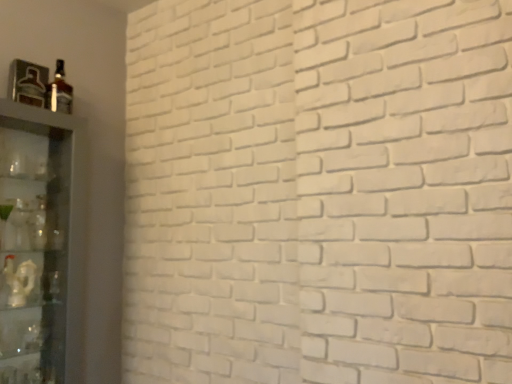
Describe the element at coordinates (59, 91) in the screenshot. This screenshot has width=512, height=384. I see `matte glass bottle at upper left, which is the first bottle from right to left` at that location.

Locate an element on the screen. clear glass shelf at left is located at coordinates (40, 244).

Where is `metallic glass bottle at upper left, placed as the first bottle when sorted from left to right`? This screenshot has height=384, width=512. metallic glass bottle at upper left, placed as the first bottle when sorted from left to right is located at coordinates (29, 84).

Would you say clear glass shelf at left is to the left or to the right of metallic glass bottle at upper left, placed as the first bottle when sorted from left to right, in the picture?

clear glass shelf at left is to the right of metallic glass bottle at upper left, placed as the first bottle when sorted from left to right.

Can you confirm if clear glass shelf at left is taller than metallic glass bottle at upper left, which is counted as the 2th bottle, starting from the right?

Correct, clear glass shelf at left is much taller as metallic glass bottle at upper left, which is counted as the 2th bottle, starting from the right.

Is clear glass shelf at left aimed at metallic glass bottle at upper left, placed as the first bottle when sorted from left to right?

No, clear glass shelf at left is not aimed at metallic glass bottle at upper left, placed as the first bottle when sorted from left to right.

Which object is thinner, clear glass shelf at left or metallic glass bottle at upper left, placed as the first bottle when sorted from left to right?

metallic glass bottle at upper left, placed as the first bottle when sorted from left to right.

Does clear glass shelf at left have a lesser width compared to matte glass bottle at upper left, acting as the second bottle starting from the left?

In fact, clear glass shelf at left might be wider than matte glass bottle at upper left, acting as the second bottle starting from the left.

Is matte glass bottle at upper left, acting as the second bottle starting from the left, completely or partially inside clear glass shelf at left?

Definitely not — matte glass bottle at upper left, acting as the second bottle starting from the left, is not inside clear glass shelf at left.

Is clear glass shelf at left far away from matte glass bottle at upper left, which is the first bottle from right to left?

They are positioned close to each other.

Who is taller, matte glass bottle at upper left, acting as the second bottle starting from the left, or clear glass shelf at left?

clear glass shelf at left is taller.

Is matte glass bottle at upper left, acting as the second bottle starting from the left, inside or outside of clear glass shelf at left?

matte glass bottle at upper left, acting as the second bottle starting from the left, is not enclosed by clear glass shelf at left.

Considering the relative positions of matte glass bottle at upper left, acting as the second bottle starting from the left, and metallic glass bottle at upper left, placed as the first bottle when sorted from left to right, in the image provided, is matte glass bottle at upper left, acting as the second bottle starting from the left, to the left or to the right of metallic glass bottle at upper left, placed as the first bottle when sorted from left to right,?

From the image, it's evident that matte glass bottle at upper left, acting as the second bottle starting from the left, is to the right of metallic glass bottle at upper left, placed as the first bottle when sorted from left to right.

Is matte glass bottle at upper left, which is the first bottle from right to left, facing towards metallic glass bottle at upper left, placed as the first bottle when sorted from left to right?

No, matte glass bottle at upper left, which is the first bottle from right to left, is not turned towards metallic glass bottle at upper left, placed as the first bottle when sorted from left to right.

Measure the distance from matte glass bottle at upper left, which is the first bottle from right to left, to metallic glass bottle at upper left, which is counted as the 2th bottle, starting from the right.

matte glass bottle at upper left, which is the first bottle from right to left, and metallic glass bottle at upper left, which is counted as the 2th bottle, starting from the right, are 2.59 inches apart.

Would you say metallic glass bottle at upper left, which is counted as the 2th bottle, starting from the right, is part of matte glass bottle at upper left, which is the first bottle from right to left,'s contents?

No, metallic glass bottle at upper left, which is counted as the 2th bottle, starting from the right, is not a part of matte glass bottle at upper left, which is the first bottle from right to left.

Is the depth of metallic glass bottle at upper left, which is counted as the 2th bottle, starting from the right, greater than that of clear glass shelf at left?

Yes, the depth of metallic glass bottle at upper left, which is counted as the 2th bottle, starting from the right, is greater than that of clear glass shelf at left.

Which of these two, metallic glass bottle at upper left, placed as the first bottle when sorted from left to right, or clear glass shelf at left, stands taller?

clear glass shelf at left is taller.

Considering the relative positions of metallic glass bottle at upper left, which is counted as the 2th bottle, starting from the right, and clear glass shelf at left in the image provided, is metallic glass bottle at upper left, which is counted as the 2th bottle, starting from the right, to the left or to the right of clear glass shelf at left?

metallic glass bottle at upper left, which is counted as the 2th bottle, starting from the right, is to the left of clear glass shelf at left.

Looking at their sizes, would you say metallic glass bottle at upper left, placed as the first bottle when sorted from left to right, is wider or thinner than matte glass bottle at upper left, which is the first bottle from right to left?

Considering their sizes, metallic glass bottle at upper left, placed as the first bottle when sorted from left to right, looks broader than matte glass bottle at upper left, which is the first bottle from right to left.

Is metallic glass bottle at upper left, placed as the first bottle when sorted from left to right, positioned with its back to matte glass bottle at upper left, acting as the second bottle starting from the left?

No, matte glass bottle at upper left, acting as the second bottle starting from the left, is not at the back of metallic glass bottle at upper left, placed as the first bottle when sorted from left to right.

Between metallic glass bottle at upper left, which is counted as the 2th bottle, starting from the right, and matte glass bottle at upper left, which is the first bottle from right to left, which one has less height?

With less height is metallic glass bottle at upper left, which is counted as the 2th bottle, starting from the right.

In the image, is metallic glass bottle at upper left, placed as the first bottle when sorted from left to right, positioned in front of or behind matte glass bottle at upper left, acting as the second bottle starting from the left?

Visually, metallic glass bottle at upper left, placed as the first bottle when sorted from left to right, is located in front of matte glass bottle at upper left, acting as the second bottle starting from the left.

This screenshot has width=512, height=384. What are the coordinates of `shelf in front of the metallic glass bottle at upper left, which is counted as the 2th bottle, starting from the right` in the screenshot? It's located at (40, 244).

From the image's perspective, which bottle is the 2nd one above the clear glass shelf at left? Please provide its 2D coordinates.

[(59, 91)]

Considering their positions, is clear glass shelf at left positioned further to metallic glass bottle at upper left, which is counted as the 2th bottle, starting from the right, than matte glass bottle at upper left, which is the first bottle from right to left?

clear glass shelf at left.

From the image, which object appears to be nearer to metallic glass bottle at upper left, which is counted as the 2th bottle, starting from the right, matte glass bottle at upper left, acting as the second bottle starting from the left, or clear glass shelf at left?

The object closer to metallic glass bottle at upper left, which is counted as the 2th bottle, starting from the right, is matte glass bottle at upper left, acting as the second bottle starting from the left.

In the scene shown: Which object lies nearer to the anchor point matte glass bottle at upper left, which is the first bottle from right to left, clear glass shelf at left or metallic glass bottle at upper left, which is counted as the 2th bottle, starting from the right?

Based on the image, metallic glass bottle at upper left, which is counted as the 2th bottle, starting from the right, appears to be nearer to matte glass bottle at upper left, which is the first bottle from right to left.

Looking at the image, which one is located closer to clear glass shelf at left, matte glass bottle at upper left, which is the first bottle from right to left, or metallic glass bottle at upper left, placed as the first bottle when sorted from left to right?

metallic glass bottle at upper left, placed as the first bottle when sorted from left to right, is closer to clear glass shelf at left.

When comparing their distances from clear glass shelf at left, does metallic glass bottle at upper left, placed as the first bottle when sorted from left to right, or matte glass bottle at upper left, which is the first bottle from right to left, seem closer?

metallic glass bottle at upper left, placed as the first bottle when sorted from left to right, is closer to clear glass shelf at left.

Estimate the real-world distances between objects in this image. Which object is further from matte glass bottle at upper left, acting as the second bottle starting from the left, metallic glass bottle at upper left, which is counted as the 2th bottle, starting from the right, or clear glass shelf at left?

clear glass shelf at left lies further to matte glass bottle at upper left, acting as the second bottle starting from the left, than the other object.

You are a GUI agent. You are given a task and a screenshot of the screen. Output one action in this format:
    pyautogui.click(x=<x>, y=<y>)
    Task: Click on the bottle between matte glass bottle at upper left, which is the first bottle from right to left, and clear glass shelf at left in the up-down direction
    
    Given the screenshot: What is the action you would take?
    pyautogui.click(x=29, y=84)